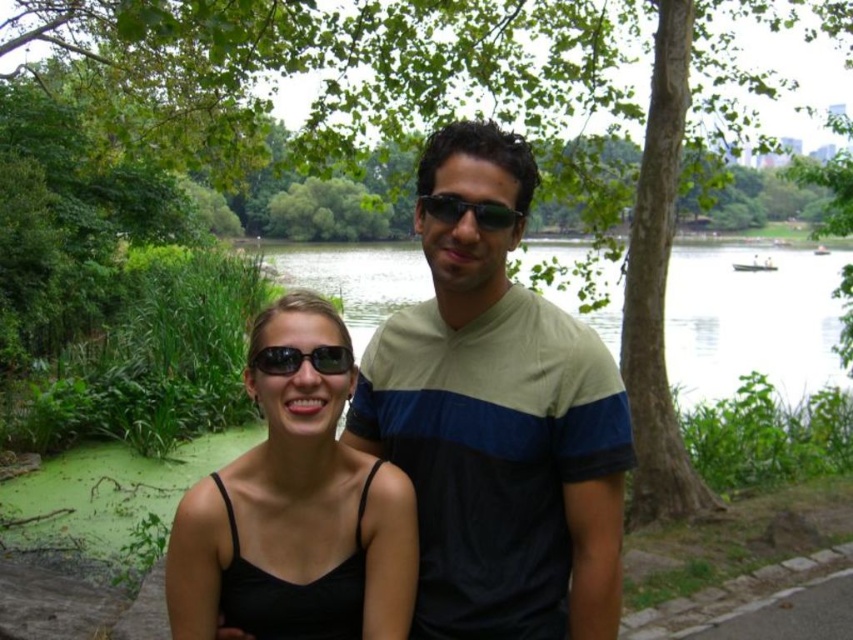
Question: Can you confirm if light beige cotton shirt at center is positioned above black matte tank top at center?

Choices:
 (A) no
 (B) yes

Answer: (B)

Question: Which point is closer to the camera taking this photo?

Choices:
 (A) (268, 346)
 (B) (798, 348)
 (C) (421, 196)
 (D) (402, 554)

Answer: (A)

Question: Can you confirm if black matte tank top at center is wider than black plastic sunglasses at center?

Choices:
 (A) yes
 (B) no

Answer: (A)

Question: Which of the following is the farthest from the observer?

Choices:
 (A) black plastic sunglasses at center
 (B) black reflective sunglasses at center
 (C) light beige cotton shirt at center
 (D) green algae water at center

Answer: (D)

Question: In this image, where is light beige cotton shirt at center located relative to black reflective sunglasses at center?

Choices:
 (A) left
 (B) right

Answer: (B)

Question: Which object appears closest to the camera in this image?

Choices:
 (A) black reflective sunglasses at center
 (B) light beige cotton shirt at center
 (C) green algae water at center

Answer: (A)